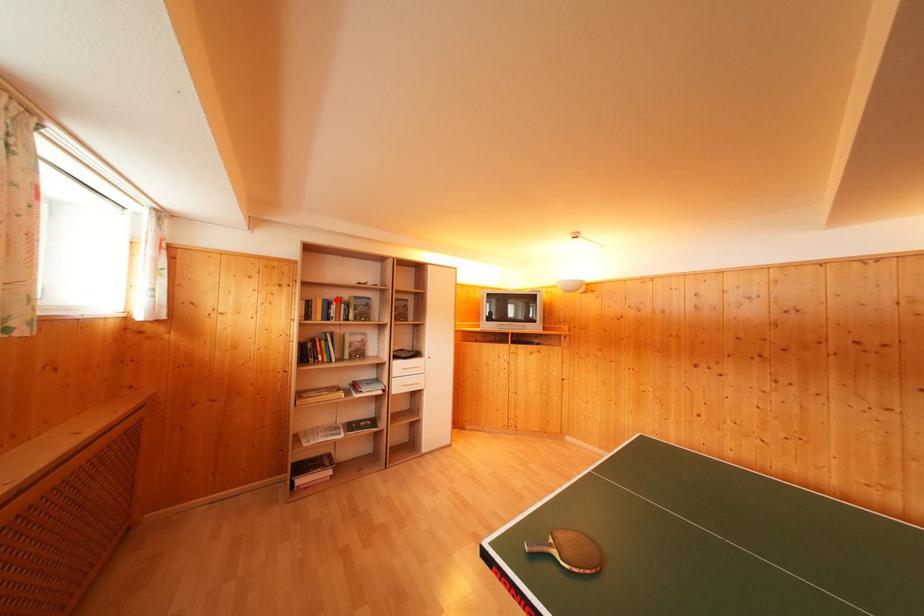
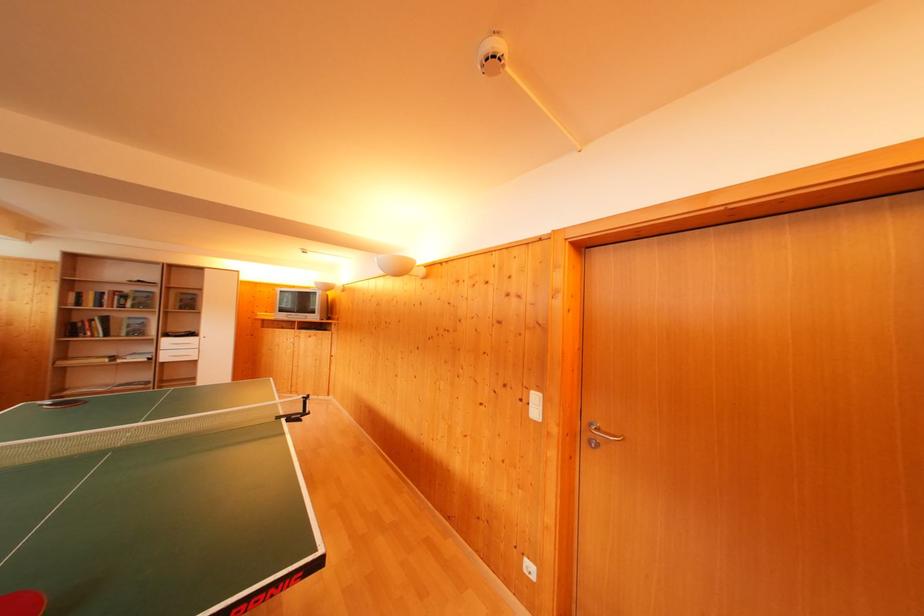
The point at the highlighted location is marked in the first image. Where is the corresponding point in the second image?

(112, 294)